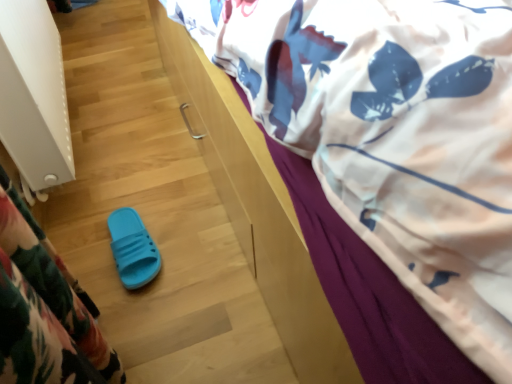
The height and width of the screenshot is (384, 512). I want to click on white printed fabric at upper right, so click(393, 136).

The width and height of the screenshot is (512, 384). In order to click on blue rubber slipper at lower left in this screenshot , I will do `click(133, 248)`.

Is white textured radiator at left positioned with its back to white printed fabric at upper right?

No, white textured radiator at left is not facing away from white printed fabric at upper right.

Is point (42, 0) farther from viewer compared to point (476, 182)?

Yes.

Between white textured radiator at left and white printed fabric at upper right, which one has less height?

Standing shorter between the two is white textured radiator at left.

Between blue rubber slipper at lower left and white printed fabric at upper right, which one is positioned in front?

Positioned in front is white printed fabric at upper right.

Is blue rubber slipper at lower left inside the boundaries of white printed fabric at upper right, or outside?

blue rubber slipper at lower left is located beyond the bounds of white printed fabric at upper right.

Does blue rubber slipper at lower left have a greater height compared to white printed fabric at upper right?

No.

Who is smaller, white printed fabric at upper right or blue rubber slipper at lower left?

With smaller size is blue rubber slipper at lower left.

Is white printed fabric at upper right not inside blue rubber slipper at lower left?

Yes, white printed fabric at upper right is outside of blue rubber slipper at lower left.

Between point (500, 262) and point (142, 229), which one is positioned in front?

Point (500, 262)

From a real-world perspective, is white printed fabric at upper right positioned above or below blue rubber slipper at lower left?

In terms of real-world spatial position, white printed fabric at upper right is above blue rubber slipper at lower left.

Does point (130, 213) lie in front of point (38, 32)?

Yes.

Relative to white textured radiator at left, is blue rubber slipper at lower left in front or behind?

blue rubber slipper at lower left is behind white textured radiator at left.

Is blue rubber slipper at lower left in contact with white textured radiator at left?

No, blue rubber slipper at lower left is not beside white textured radiator at left.

Considering the sizes of objects white textured radiator at left and blue rubber slipper at lower left in the image provided, who is wider, white textured radiator at left or blue rubber slipper at lower left?

white textured radiator at left is wider.

Is white textured radiator at left next to blue rubber slipper at lower left and touching it?

No, white textured radiator at left is not in contact with blue rubber slipper at lower left.

From the image's perspective, who appears lower, white textured radiator at left or blue rubber slipper at lower left?

From the image's view, blue rubber slipper at lower left is below.

Which is more to the right, white textured radiator at left or blue rubber slipper at lower left?

blue rubber slipper at lower left is more to the right.

From the image's perspective, does white printed fabric at upper right appear lower than white textured radiator at left?

Incorrect, from the image's perspective, white printed fabric at upper right is higher than white textured radiator at left.

Based on the photo, is white printed fabric at upper right facing towards white textured radiator at left?

No, white printed fabric at upper right is not aimed at white textured radiator at left.

Who is shorter, white printed fabric at upper right or white textured radiator at left?

Standing shorter between the two is white textured radiator at left.

The height and width of the screenshot is (384, 512). In order to click on bed above the white textured radiator at left (from the image's perspective) in this screenshot , I will do `click(393, 136)`.

Image resolution: width=512 pixels, height=384 pixels. Identify the location of footwear beneath the white printed fabric at upper right (from a real-world perspective). (133, 248).

Looking at the image, which one is located further to blue rubber slipper at lower left, white textured radiator at left or white printed fabric at upper right?

white printed fabric at upper right is positioned further to the anchor blue rubber slipper at lower left.

Which object lies further to the anchor point blue rubber slipper at lower left, white printed fabric at upper right or white textured radiator at left?

white printed fabric at upper right lies further to blue rubber slipper at lower left than the other object.

When comparing their distances from white printed fabric at upper right, does blue rubber slipper at lower left or white textured radiator at left seem further?

The object further to white printed fabric at upper right is blue rubber slipper at lower left.

Which object lies nearer to the anchor point white printed fabric at upper right, white textured radiator at left or blue rubber slipper at lower left?

Among the two, white textured radiator at left is located nearer to white printed fabric at upper right.

Based on their spatial positions, is white printed fabric at upper right or blue rubber slipper at lower left further from white textured radiator at left?

white printed fabric at upper right lies further to white textured radiator at left than the other object.

From the image, which object appears to be farther from white textured radiator at left, blue rubber slipper at lower left or white printed fabric at upper right?

white printed fabric at upper right.

Find the location of a particular element. Image resolution: width=512 pixels, height=384 pixels. radiator located between white printed fabric at upper right and blue rubber slipper at lower left in the depth direction is located at coordinates (34, 94).